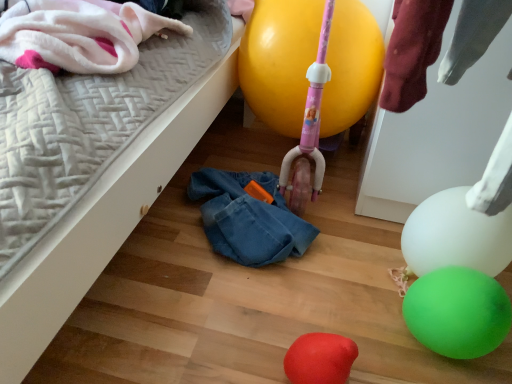
The image size is (512, 384). I want to click on free location to the left of green rubber balloon at lower right, the third balloon in the top-to-bottom sequence, so click(x=352, y=320).